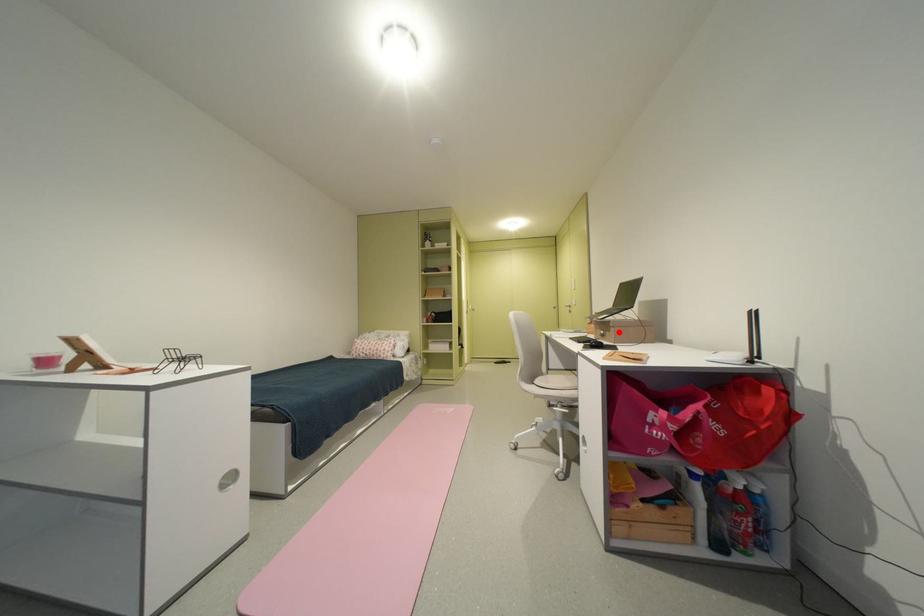
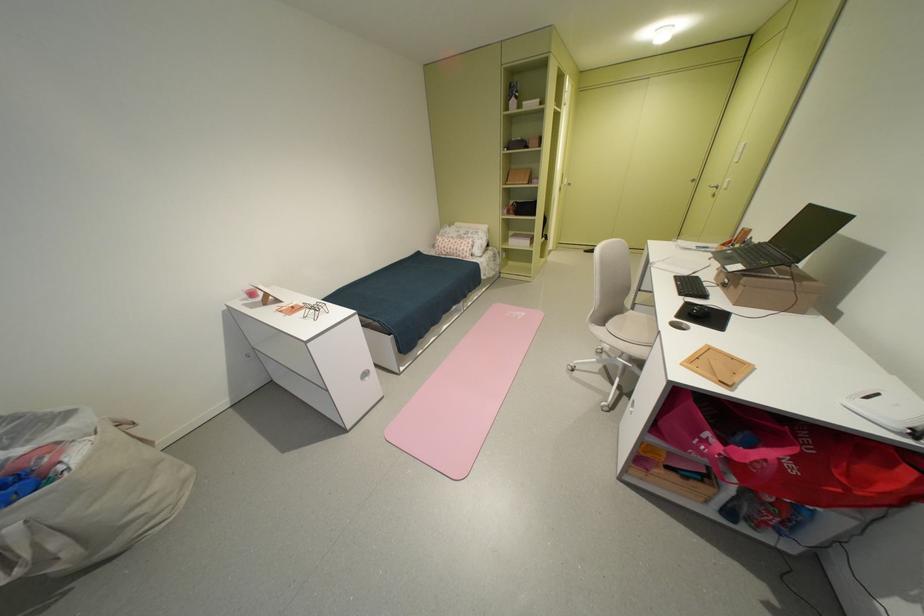
The point at the highlighted location is marked in the first image. Where is the corresponding point in the second image?

(746, 288)